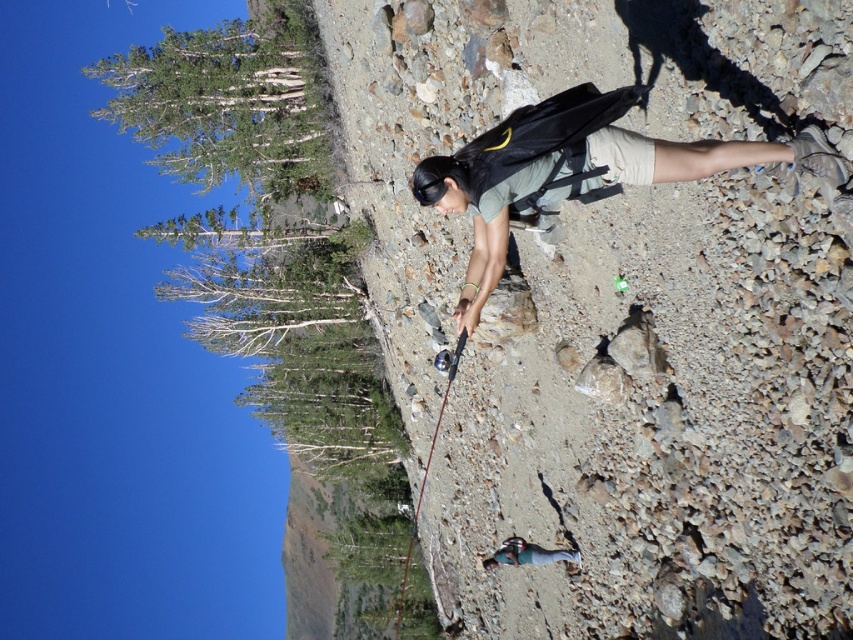
Question: Which object appears farthest from the camera in this image?

Choices:
 (A) matte gray backpack at center
 (B) brown rocky cliff at center

Answer: (A)

Question: Is brown rocky cliff at center wider than matte gray backpack at center?

Choices:
 (A) yes
 (B) no

Answer: (A)

Question: Does brown rocky cliff at center have a greater width compared to matte gray backpack at center?

Choices:
 (A) yes
 (B) no

Answer: (A)

Question: Which point is closer to the camera?

Choices:
 (A) matte gray backpack at center
 (B) brown rocky cliff at center

Answer: (B)

Question: Which point is farther to the camera?

Choices:
 (A) (579, 561)
 (B) (339, 10)

Answer: (B)

Question: Can you confirm if brown rocky cliff at center is positioned to the right of matte gray backpack at center?

Choices:
 (A) yes
 (B) no

Answer: (B)